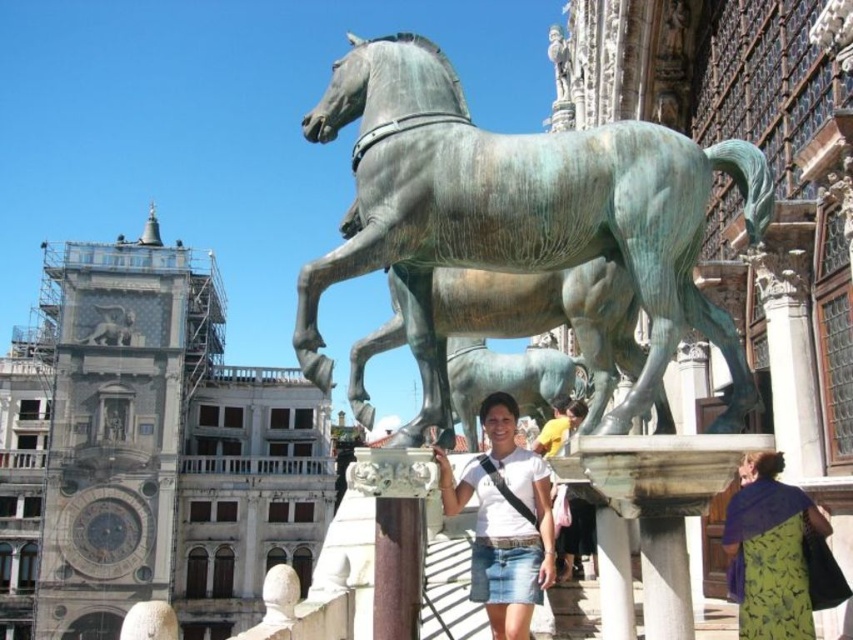
Question: Which point appears farthest from the camera in this image?

Choices:
 (A) (387, 52)
 (B) (113, 316)
 (C) (756, 625)

Answer: (B)

Question: Does green patina bronze horse at center have a smaller size compared to green floral dress at lower right?

Choices:
 (A) no
 (B) yes

Answer: (A)

Question: Can you confirm if green patina bronze horse at center is positioned above bronze statue at upper center?

Choices:
 (A) yes
 (B) no

Answer: (A)

Question: Where is white fabric shirt at center located in relation to bronze statue at upper center in the image?

Choices:
 (A) right
 (B) left

Answer: (A)

Question: Estimate the real-world distances between objects in this image. Which object is closer to the green floral dress at lower right?

Choices:
 (A) green patina bronze horse at center
 (B) white fabric shirt at center
 (C) bronze statue at upper center

Answer: (A)

Question: Among these objects, which one is nearest to the camera?

Choices:
 (A) green patina bronze horse at center
 (B) bronze statue at upper center

Answer: (A)